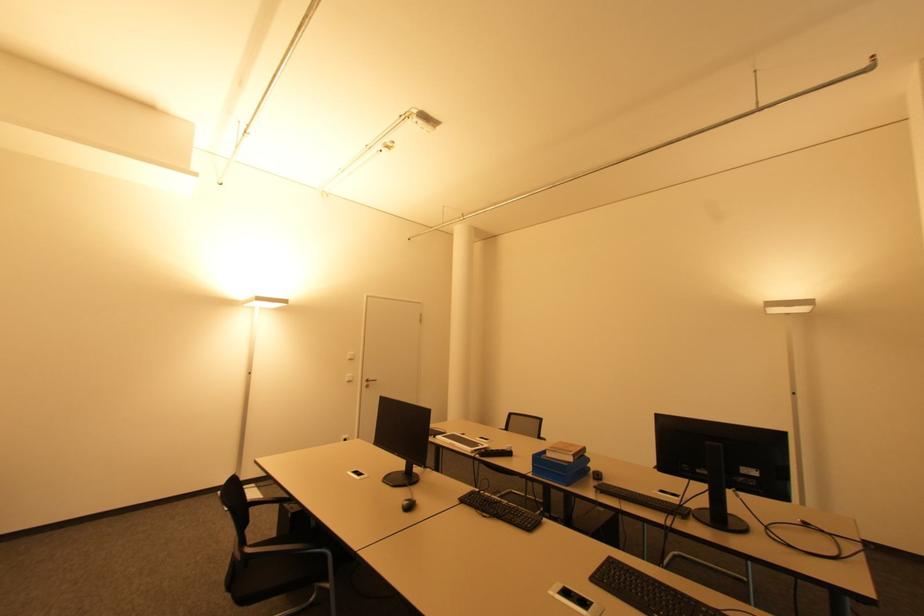
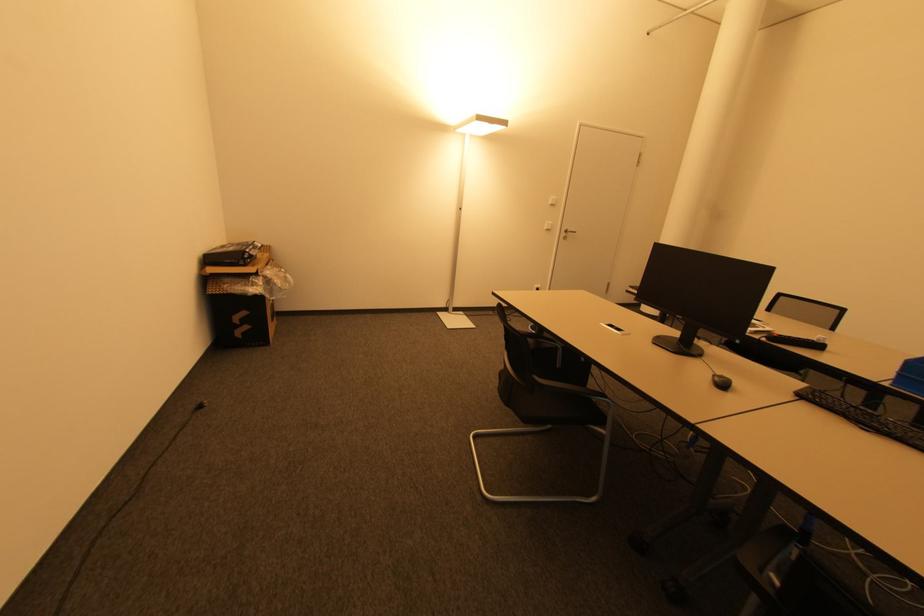
Locate, in the second image, the point that corresponds to the point at 367,384 in the first image.

(565, 235)